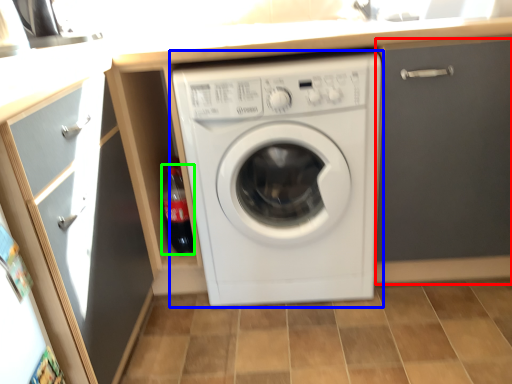
Question: Based on their relative distances, which object is farther from door (highlighted by a red box)? Choose from washing machine (highlighted by a blue box) and bottle (highlighted by a green box).

Choices:
 (A) washing machine
 (B) bottle

Answer: (B)